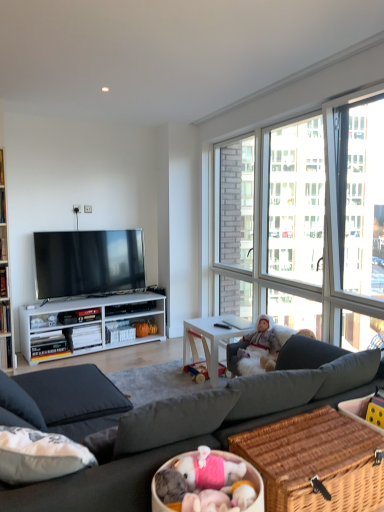
Locate an element on the screen. This screenshot has height=512, width=384. vacant point above matte black tv at center (from a real-world perspective) is located at coordinates (82, 225).